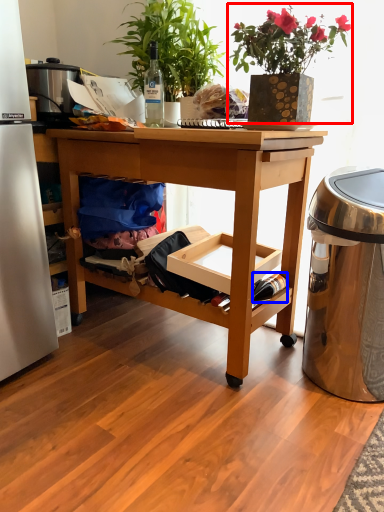
Question: Which of the following is the farthest to the observer, houseplant (highlighted by a red box) or bottle (highlighted by a blue box)?

Choices:
 (A) houseplant
 (B) bottle

Answer: (B)